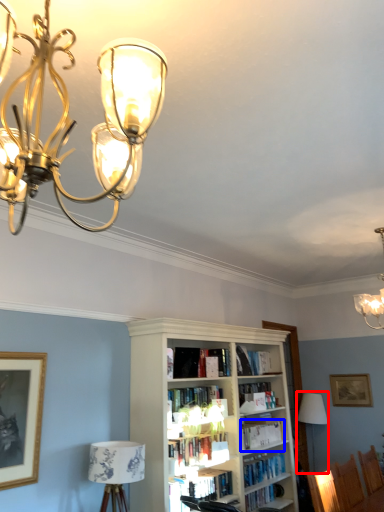
Question: Which object is further to the camera taking this photo, table lamp (highlighted by a red box) or book (highlighted by a blue box)?

Choices:
 (A) table lamp
 (B) book

Answer: (A)